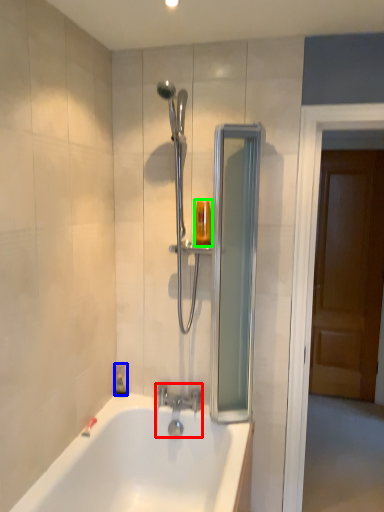
Question: Which object is positioned farthest from tap (highlighted by a red box)? Select from soap dispenser (highlighted by a blue box) and toiletry (highlighted by a green box).

Choices:
 (A) soap dispenser
 (B) toiletry

Answer: (B)